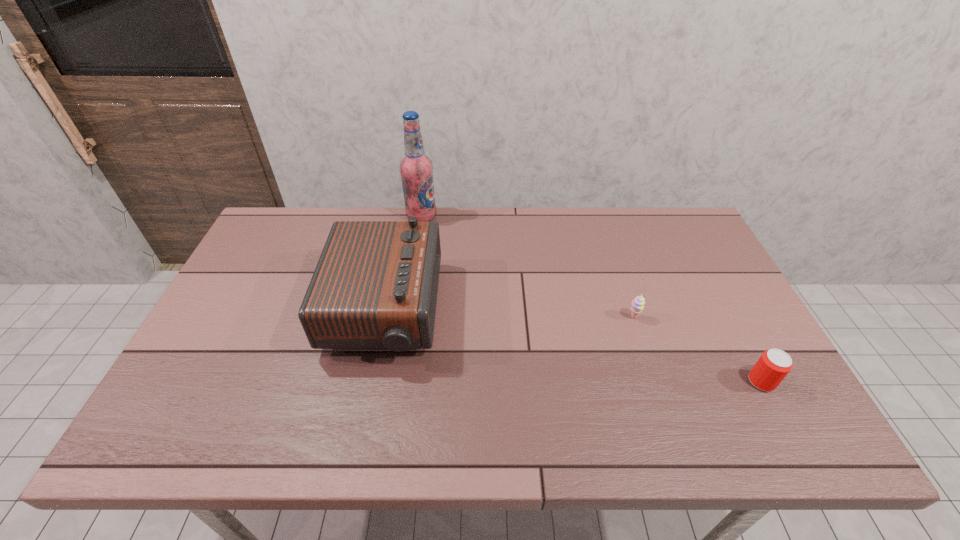
The height and width of the screenshot is (540, 960). What are the coordinates of `alcohol` in the screenshot? It's located at coord(416,169).

At what (x,y) coordinates should I click in order to perform the action: click on the farthest object. Please return your answer as a coordinate pair (x, y). Looking at the image, I should click on (416, 169).

In order to click on radio receiver in this screenshot , I will do `click(375, 286)`.

The width and height of the screenshot is (960, 540). In order to click on beer can in this screenshot , I will do `click(772, 367)`.

I want to click on the rightmost object, so click(772, 367).

The width and height of the screenshot is (960, 540). What are the coordinates of `the third object from left to right` in the screenshot? It's located at (638, 303).

What are the coordinates of `blank area located 0.330m on the left of the alcohol` in the screenshot? It's located at (311, 217).

Where is `vacant point located 0.380m on the tuning display of the radio receiver`? The image size is (960, 540). vacant point located 0.380m on the tuning display of the radio receiver is located at coordinates (575, 310).

The height and width of the screenshot is (540, 960). I want to click on free point located on the back of the nearest object, so click(747, 354).

Where is `vacant space situated 0.320m on the left of the third object from left to right`? Image resolution: width=960 pixels, height=540 pixels. vacant space situated 0.320m on the left of the third object from left to right is located at coordinates (510, 318).